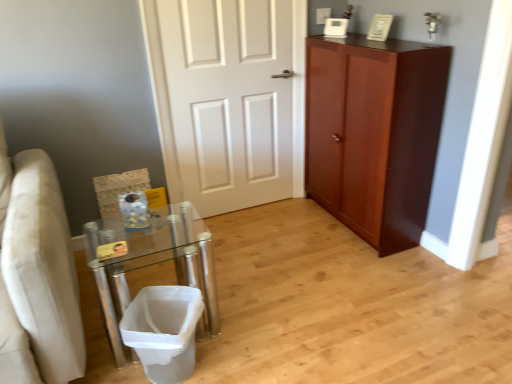
Find the location of a particular element. white painted wood door at center is located at coordinates (228, 99).

Image resolution: width=512 pixels, height=384 pixels. What are the coordinates of `clear glass table at lower left` in the screenshot? It's located at (153, 265).

Do you think white painted wood door at center is within clear glass table at lower left, or outside of it?

white painted wood door at center is not enclosed by clear glass table at lower left.

Consider the image. From the image's perspective, which object appears higher, white painted wood door at center or clear glass table at lower left?

white painted wood door at center.

From a real-world perspective, relative to clear glass table at lower left, is white painted wood door at center vertically above or below?

white painted wood door at center is situated higher than clear glass table at lower left in the real world.

Which of these two, white painted wood door at center or clear glass table at lower left, is thinner?

Thinner between the two is white painted wood door at center.

The image size is (512, 384). I want to click on door above the clear glass table at lower left (from the image's perspective), so click(x=228, y=99).

Is clear glass table at lower left oriented towards white painted wood door at center?

No, clear glass table at lower left is not oriented towards white painted wood door at center.

Based on the photo, does clear glass table at lower left touch white painted wood door at center?

clear glass table at lower left is not next to white painted wood door at center, and they're not touching.

Who is taller, clear glass table at lower left or white painted wood door at center?

white painted wood door at center is taller.

From a real-world perspective, who is located lower, mahogany wood cabinet at right or clear glass table at lower left?

clear glass table at lower left is physically lower.

Is mahogany wood cabinet at right further to camera compared to clear glass table at lower left?

Yes, mahogany wood cabinet at right is further from the viewer.

How different are the orientations of mahogany wood cabinet at right and clear glass table at lower left in degrees?

There is a 90.2-degree angle between the facing directions of mahogany wood cabinet at right and clear glass table at lower left.

Between mahogany wood cabinet at right and clear glass table at lower left, which one has larger size?

mahogany wood cabinet at right is bigger.

You are a GUI agent. You are given a task and a screenshot of the screen. Output one action in this format:
    pyautogui.click(x=<x>, y=<y>)
    Task: Click on the table above the white mesh laundry basket at lower left (from a real-world perspective)
    
    Given the screenshot: What is the action you would take?
    pyautogui.click(x=153, y=265)

Is clear glass table at lower left smaller than white mesh laundry basket at lower left?

No, clear glass table at lower left is not smaller than white mesh laundry basket at lower left.

From the image's perspective, does clear glass table at lower left appear lower than white mesh laundry basket at lower left?

No, from the image's perspective, clear glass table at lower left is not beneath white mesh laundry basket at lower left.

Is clear glass table at lower left not close to white mesh laundry basket at lower left?

No, clear glass table at lower left is not far away from white mesh laundry basket at lower left.

Is white mesh laundry basket at lower left facing away from white painted wood door at center?

Yes.

From a real-world perspective, is white mesh laundry basket at lower left beneath white painted wood door at center?

Yes, from a real-world perspective, white mesh laundry basket at lower left is beneath white painted wood door at center.

What's the angular difference between white mesh laundry basket at lower left and white painted wood door at center's facing directions?

The facing directions of white mesh laundry basket at lower left and white painted wood door at center are 36.1 degrees apart.

From the image's perspective, between white mesh laundry basket at lower left and white painted wood door at center, who is located below?

From the image's view, white mesh laundry basket at lower left is below.

From a real-world perspective, is white mesh laundry basket at lower left above or below clear glass table at lower left?

In terms of real-world spatial position, white mesh laundry basket at lower left is below clear glass table at lower left.

Is white mesh laundry basket at lower left not within clear glass table at lower left?

No, most part of white mesh laundry basket at lower left lies within clear glass table at lower left.

Between white mesh laundry basket at lower left and clear glass table at lower left, which one has larger width?

With larger width is clear glass table at lower left.

Which object is thinner, white painted wood door at center or white mesh laundry basket at lower left?

With smaller width is white painted wood door at center.

How different are the orientations of white painted wood door at center and white mesh laundry basket at lower left in degrees?

36.1 degrees.

Considering the sizes of white painted wood door at center and white mesh laundry basket at lower left in the image, is white painted wood door at center taller or shorter than white mesh laundry basket at lower left?

In the image, white painted wood door at center appears to be taller than white mesh laundry basket at lower left.

Locate an element on the screen. The image size is (512, 384). door on the right of white mesh laundry basket at lower left is located at coordinates (228, 99).

Locate an element on the screen. The height and width of the screenshot is (384, 512). table on the left of white painted wood door at center is located at coordinates (153, 265).

Identify the location of door on the right of clear glass table at lower left. Image resolution: width=512 pixels, height=384 pixels. (228, 99).

Estimate the real-world distances between objects in this image. Which object is closer to white painted wood door at center, clear glass table at lower left or white mesh laundry basket at lower left?

clear glass table at lower left is closer to white painted wood door at center.

Which object lies further to the anchor point white mesh laundry basket at lower left, white painted wood door at center or mahogany wood cabinet at right?

Among the two, mahogany wood cabinet at right is located further to white mesh laundry basket at lower left.

Which object lies further to the anchor point white painted wood door at center, clear glass table at lower left or mahogany wood cabinet at right?

The object further to white painted wood door at center is clear glass table at lower left.

Estimate the real-world distances between objects in this image. Which object is further from white mesh laundry basket at lower left, mahogany wood cabinet at right or clear glass table at lower left?

mahogany wood cabinet at right is further to white mesh laundry basket at lower left.

Based on their spatial positions, is clear glass table at lower left or white painted wood door at center further from white mesh laundry basket at lower left?

white painted wood door at center is positioned further to the anchor white mesh laundry basket at lower left.

Looking at the image, which one is located closer to white painted wood door at center, mahogany wood cabinet at right or clear glass table at lower left?

mahogany wood cabinet at right is positioned closer to the anchor white painted wood door at center.

In the scene shown: Based on their spatial positions, is white painted wood door at center or clear glass table at lower left further from mahogany wood cabinet at right?

Among the two, clear glass table at lower left is located further to mahogany wood cabinet at right.

Which object lies nearer to the anchor point clear glass table at lower left, mahogany wood cabinet at right or white painted wood door at center?

white painted wood door at center.

The image size is (512, 384). Find the location of `table that lies between white painted wood door at center and white mesh laundry basket at lower left from top to bottom`. table that lies between white painted wood door at center and white mesh laundry basket at lower left from top to bottom is located at coordinates (153, 265).

The image size is (512, 384). What are the coordinates of `laundry basket between clear glass table at lower left and mahogany wood cabinet at right from left to right` in the screenshot? It's located at (164, 331).

Image resolution: width=512 pixels, height=384 pixels. In order to click on cabinetry that lies between white painted wood door at center and white mesh laundry basket at lower left from top to bottom in this screenshot , I will do `click(374, 134)`.

Find the location of a particular element. door between clear glass table at lower left and mahogany wood cabinet at right is located at coordinates (228, 99).